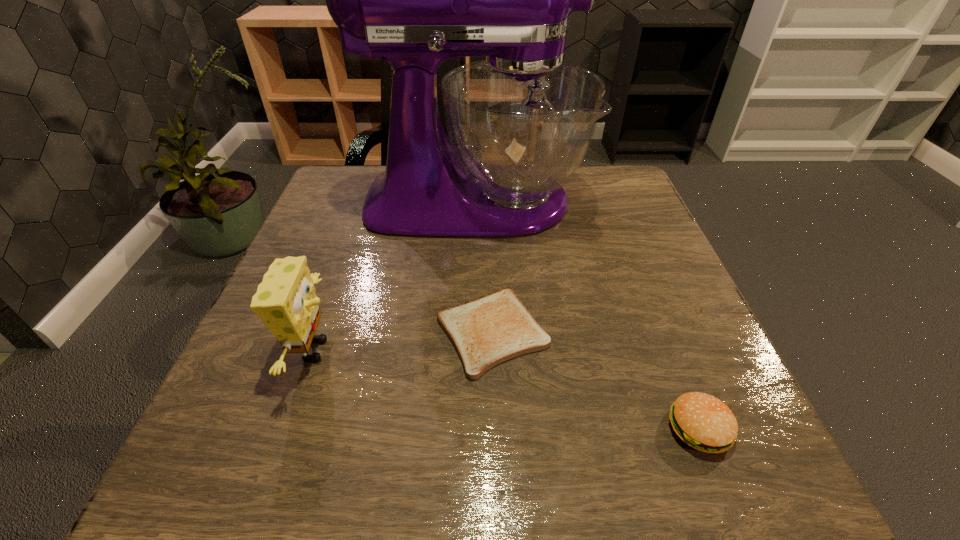
Locate an element on the screen. The height and width of the screenshot is (540, 960). object present at the far edge is located at coordinates (520, 122).

Find the location of a particular element. This screenshot has height=540, width=960. object situated at the near edge is located at coordinates (702, 421).

This screenshot has width=960, height=540. Identify the location of mixer that is positioned at the left edge. (520, 122).

Find the location of a particular element. The image size is (960, 540). sponge that is at the left edge is located at coordinates (285, 300).

Locate an element on the screen. This screenshot has width=960, height=540. mixer that is at the right edge is located at coordinates (520, 122).

Identify the location of patty at the right edge. This screenshot has width=960, height=540. (702, 421).

At what (x,y) coordinates should I click in order to perform the action: click on object present at the far left corner. Please return your answer as a coordinate pair (x, y). Looking at the image, I should click on (520, 122).

You are a GUI agent. You are given a task and a screenshot of the screen. Output one action in this format:
    pyautogui.click(x=<x>, y=<y>)
    Task: Click on the object that is at the far right corner
    The width and height of the screenshot is (960, 540).
    Given the screenshot: What is the action you would take?
    [x=520, y=122]

Locate an element on the screen. object present at the near right corner is located at coordinates (702, 421).

In the image, there is a desktop. Identify the location of vacant region at the left edge. The height and width of the screenshot is (540, 960). (323, 215).